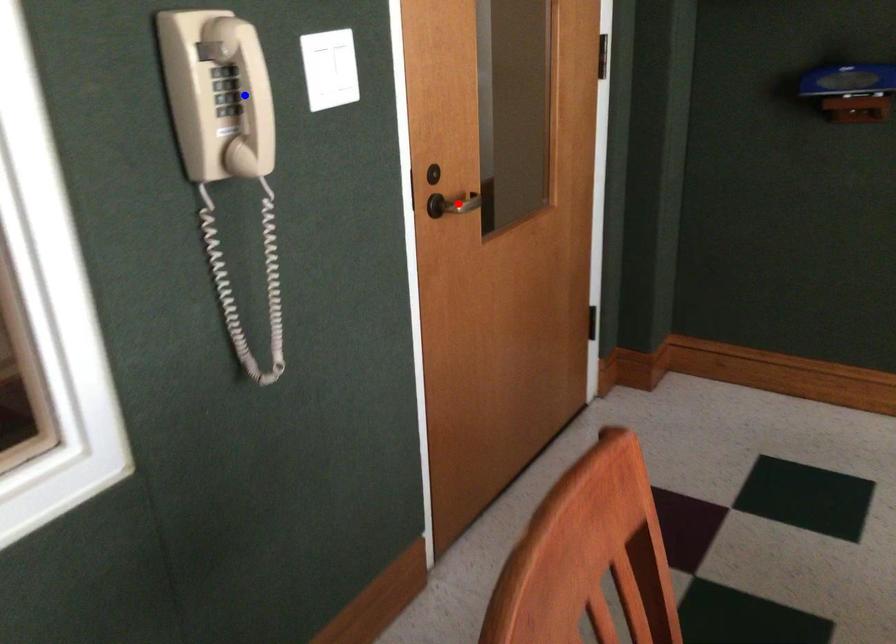
Question: Which of the two points in the image is closer to the camera?

Choices:
 (A) Blue point is closer.
 (B) Red point is closer.

Answer: (A)